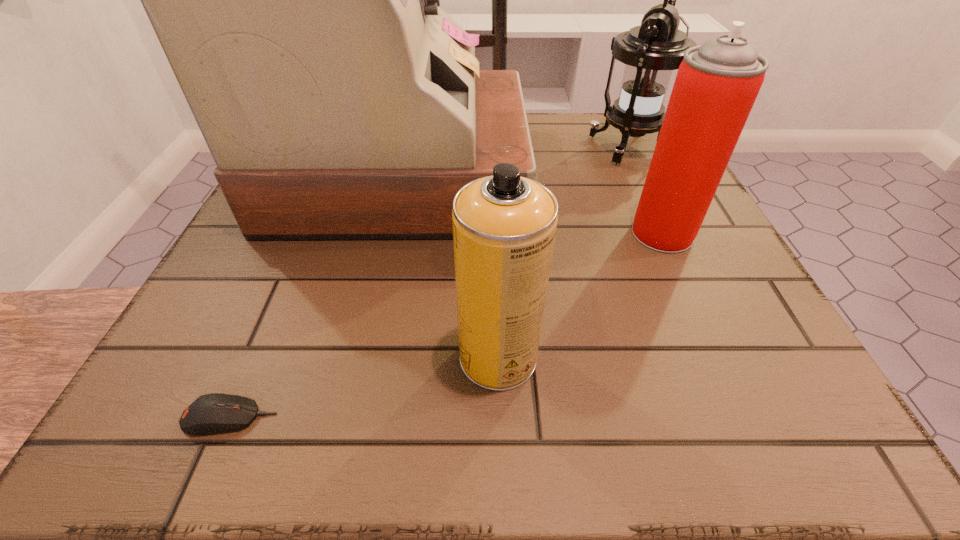
Where is `free region located 0.120m on the back of the shorter aerosol can`? The image size is (960, 540). free region located 0.120m on the back of the shorter aerosol can is located at coordinates (495, 270).

Identify the location of vacant space located 0.180m on the back of the shortest object. This screenshot has height=540, width=960. (282, 295).

Where is `cash register at the far edge`? The image size is (960, 540). cash register at the far edge is located at coordinates (297, 0).

Where is `lantern present at the far edge`? lantern present at the far edge is located at coordinates (651, 51).

Identify the location of aerosol can at the near edge. This screenshot has height=540, width=960. (504, 226).

Image resolution: width=960 pixels, height=540 pixels. Find the location of `computer mouse that is at the near edge`. computer mouse that is at the near edge is located at coordinates (212, 413).

Where is `cash register that is at the left edge`? The height and width of the screenshot is (540, 960). cash register that is at the left edge is located at coordinates (297, 0).

Identify the location of computer mouse present at the left edge. (212, 413).

This screenshot has width=960, height=540. I want to click on aerosol can at the right edge, so click(717, 83).

The height and width of the screenshot is (540, 960). I want to click on lantern that is at the right edge, so click(x=651, y=51).